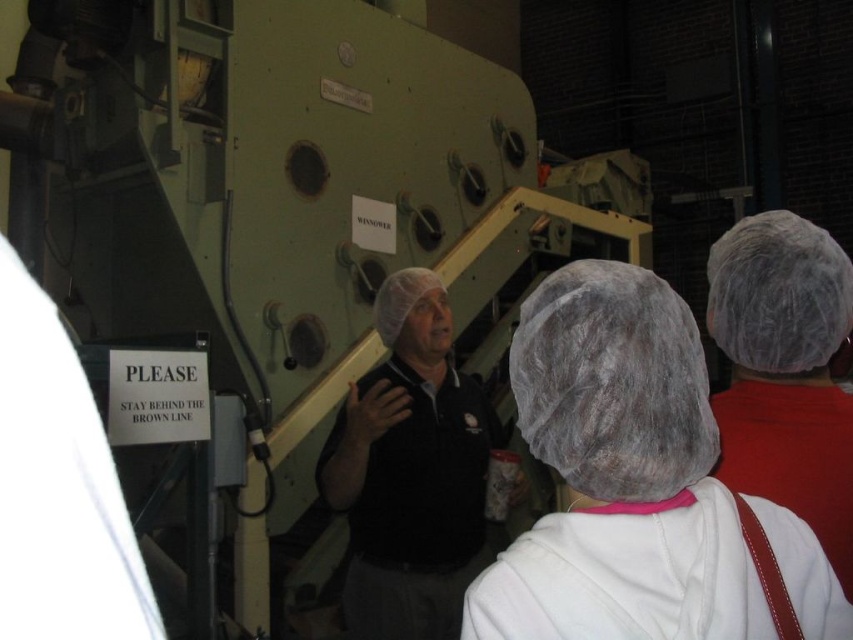
Question: Can you confirm if white textured hairnet at center is wider than black matte shirt at center?

Choices:
 (A) yes
 (B) no

Answer: (B)

Question: Does black matte shirt at center have a greater width compared to white fuzzy hairnet at upper right?

Choices:
 (A) yes
 (B) no

Answer: (A)

Question: Estimate the real-world distances between objects in this image. Which object is closer to the white textured hairnet at center?

Choices:
 (A) white fuzzy hairnet at upper right
 (B) black matte shirt at center

Answer: (A)

Question: Among these objects, which one is nearest to the camera?

Choices:
 (A) black matte shirt at center
 (B) white textured hairnet at center
 (C) white fuzzy hairnet at upper right

Answer: (B)

Question: Estimate the real-world distances between objects in this image. Which object is closer to the white textured hairnet at center?

Choices:
 (A) black matte shirt at center
 (B) white fuzzy hairnet at upper right

Answer: (B)

Question: Does white textured hairnet at center have a greater width compared to black matte shirt at center?

Choices:
 (A) no
 (B) yes

Answer: (A)